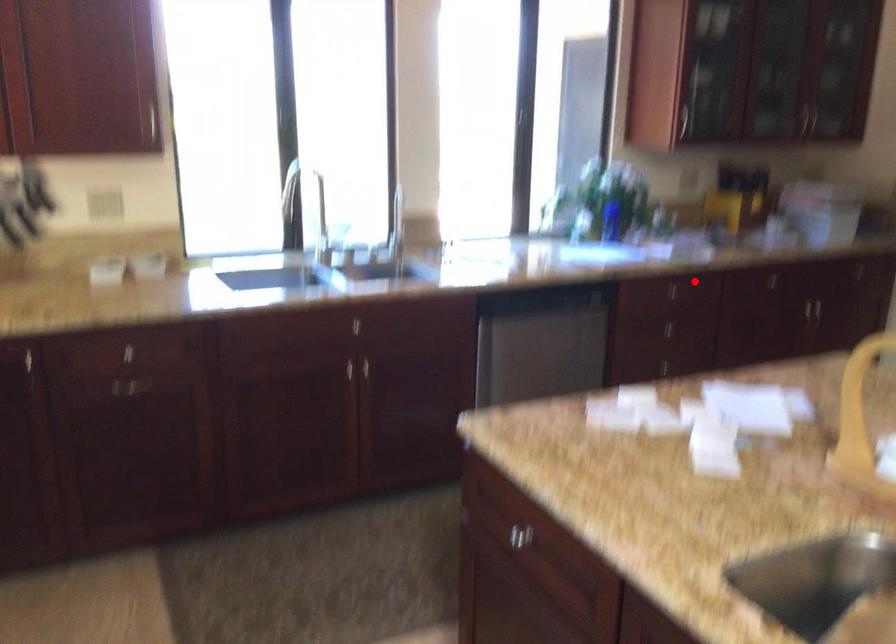
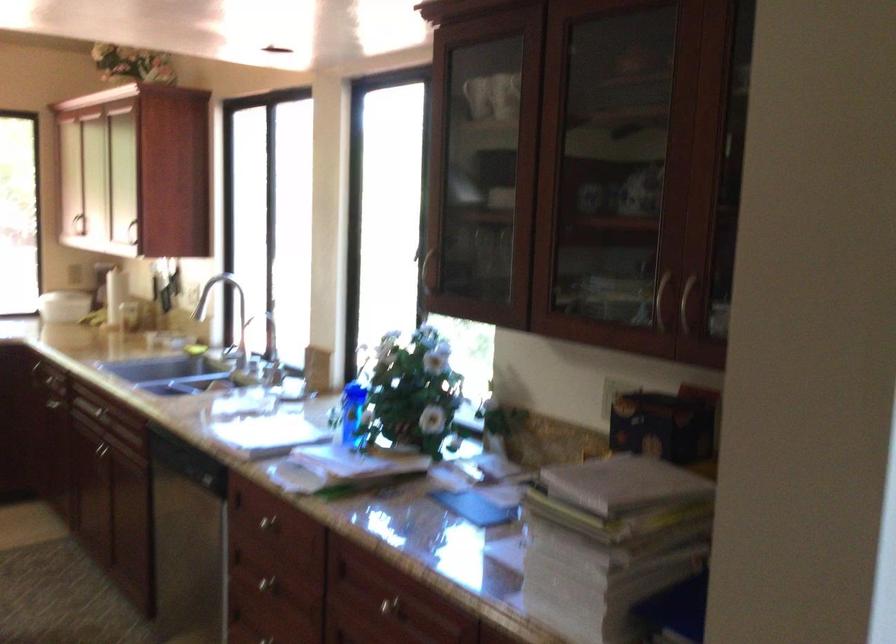
Where in the second image is the point corresponding to the highlighted location from the first image?

(266, 522)